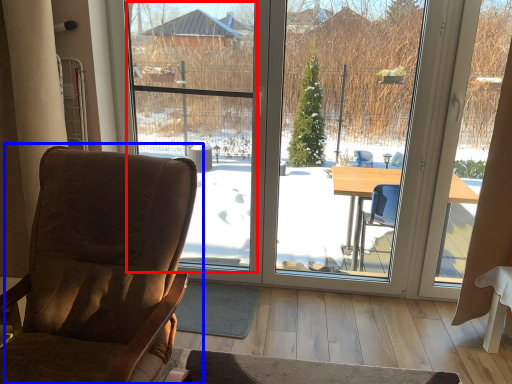
Question: Which object appears farthest to the camera in this image, window screen (highlighted by a red box) or chair (highlighted by a blue box)?

Choices:
 (A) window screen
 (B) chair

Answer: (A)